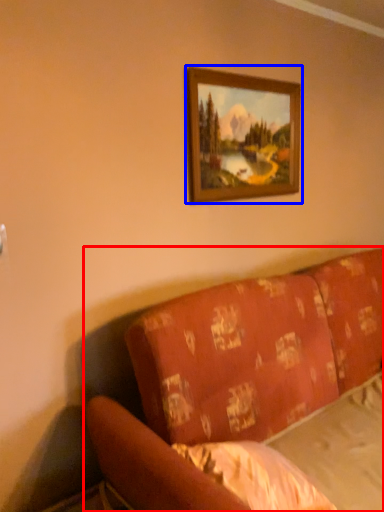
Question: Which object appears closest to the camera in this image, studio couch (highlighted by a red box) or picture frame (highlighted by a blue box)?

Choices:
 (A) studio couch
 (B) picture frame

Answer: (A)